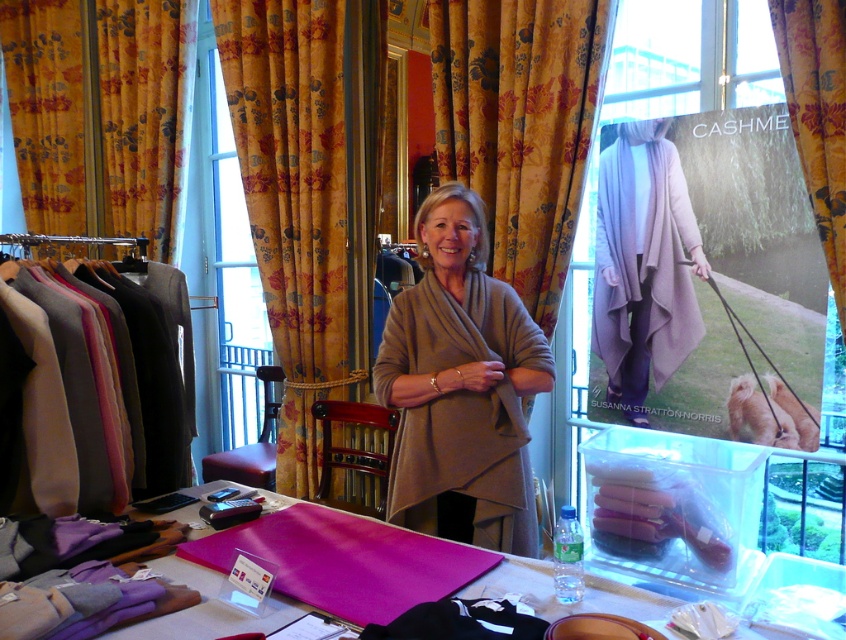
Question: Which of the following is the closest to the observer?

Choices:
 (A) (55, 3)
 (B) (75, 282)
 (C) (272, 282)

Answer: (B)

Question: Which point is farther to the camera?

Choices:
 (A) (157, 568)
 (B) (333, 250)

Answer: (B)

Question: Does matte wool sweater at left appear on the left side of pink fabric at center?

Choices:
 (A) yes
 (B) no

Answer: (A)

Question: Does yellow floral fabric curtain at center have a lesser width compared to pink fabric at center?

Choices:
 (A) yes
 (B) no

Answer: (A)

Question: Among these objects, which one is nearest to the camera?

Choices:
 (A) yellow floral fabric at upper left
 (B) beige woolen shawl at center
 (C) yellow floral fabric curtain at center
 (D) yellow floral fabric at upper right

Answer: (B)

Question: Is yellow floral fabric at upper left to the right of light purple cashmere scarf at center from the viewer's perspective?

Choices:
 (A) no
 (B) yes

Answer: (A)